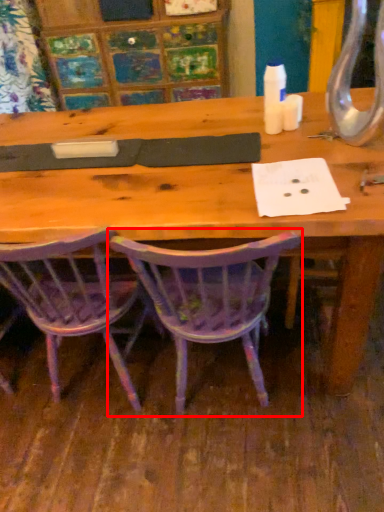
Question: From the image's perspective, what is the correct spatial positioning of chair (annotated by the red box) in reference to chair?

Choices:
 (A) below
 (B) above

Answer: (A)